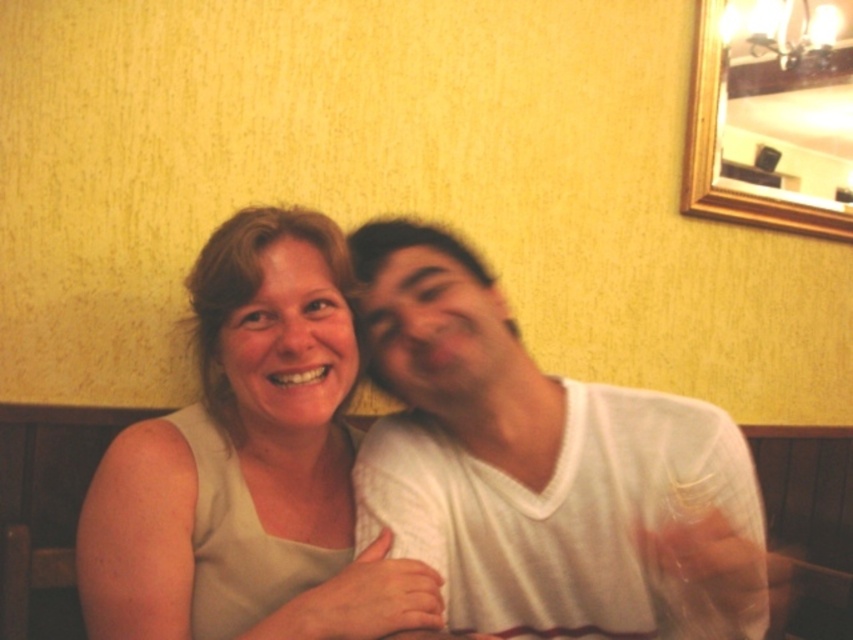
You are a photographer setting up for a group photo. You need to ensure that the matte beige blouse at center and the gold wooden picture frame at upper right are at least 1.5 meters apart to avoid overlapping in the shot. Based on the scene description, will their current positions meet this requirement?

The matte beige blouse at center and gold wooden picture frame at upper right are 1.42 meters apart, which is less than the required 1.5 meters. Therefore, their current positions do not meet the requirement, and adjustments are needed to increase the distance between them.

Based on the coordinates provided, which object is located at point (543, 468) in the image?

The point (543, 468) indicates the white cotton shirt at center.

Based on the scene description, how far apart are the two people wearing the white cotton shirt at center?

The two people wearing the white cotton shirt at center are 30.67 inches apart.